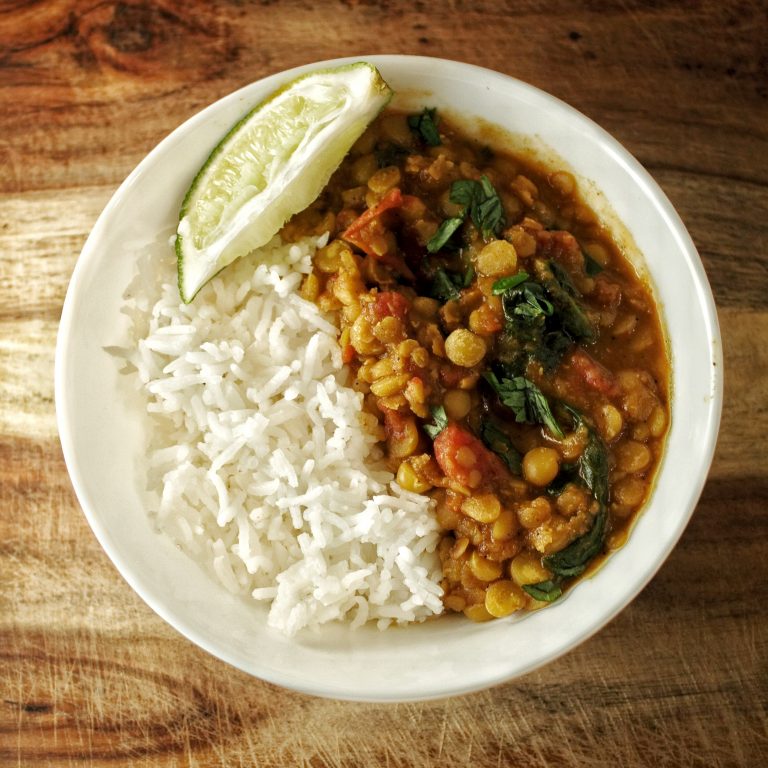
The width and height of the screenshot is (768, 768). In order to click on tabletop in this screenshot , I will do `click(654, 684)`, `click(706, 110)`.